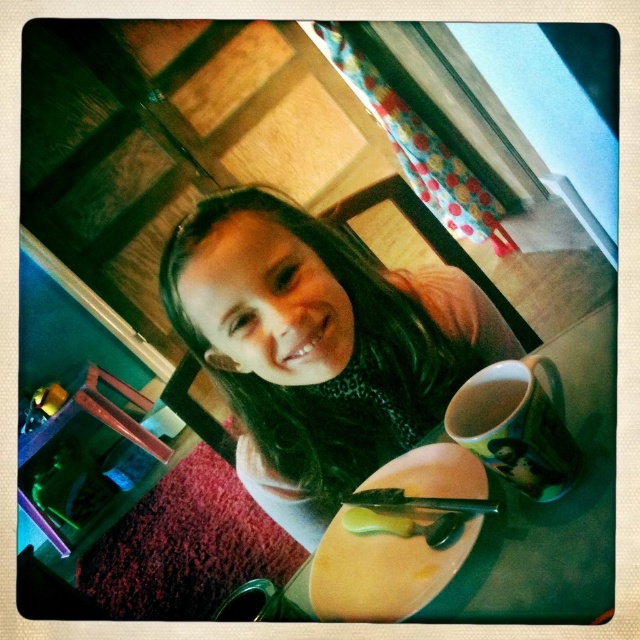
Which is more to the left, green matte mug at lower right or matte white cup at lower right?

matte white cup at lower right

Is green matte mug at lower right shorter than matte white cup at lower right?

No, green matte mug at lower right is not shorter than matte white cup at lower right.

This screenshot has width=640, height=640. Identify the location of green matte mug at lower right. (516, 426).

Where is `green matte mug at lower right`? This screenshot has height=640, width=640. green matte mug at lower right is located at coordinates (516, 426).

Looking at this image, can you confirm if yellow matte plate at center is positioned to the right of green matte mug at lower right?

No, yellow matte plate at center is not to the right of green matte mug at lower right.

Is yellow matte plate at center smaller than green matte mug at lower right?

No.

Identify the location of yellow matte plate at center. (380, 572).

Is matte white cup at lower right taller than yellow buttery spread at lower center?

Indeed, matte white cup at lower right has a greater height compared to yellow buttery spread at lower center.

From the picture: Is matte white cup at lower right to the right of yellow buttery spread at lower center from the viewer's perspective?

Yes, matte white cup at lower right is to the right of yellow buttery spread at lower center.

The width and height of the screenshot is (640, 640). Identify the location of matte white cup at lower right. (483, 404).

Image resolution: width=640 pixels, height=640 pixels. Identify the location of matte white cup at lower right. (483, 404).